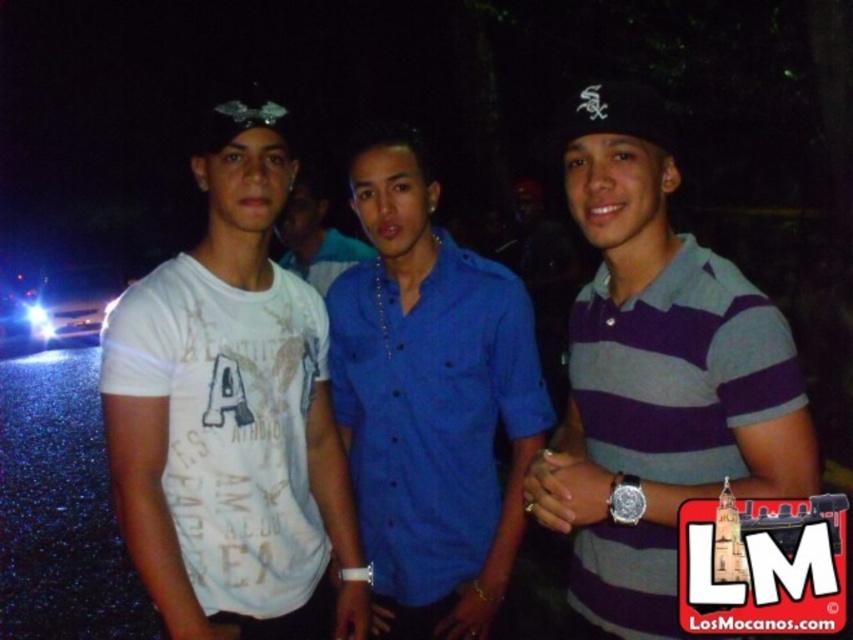
You are a photographer adjusting your camera settings to focus on two specific points in the image. The first point is at coordinates point (x=648, y=224) and the second point is at coordinates point (x=659, y=122). Which point should you focus on first to ensure the closest object is in sharp focus?

Point (x=648, y=224) is further to the camera than point (x=659, y=122), so you should focus on point (x=648, y=224) first to capture the closest object in sharp focus.